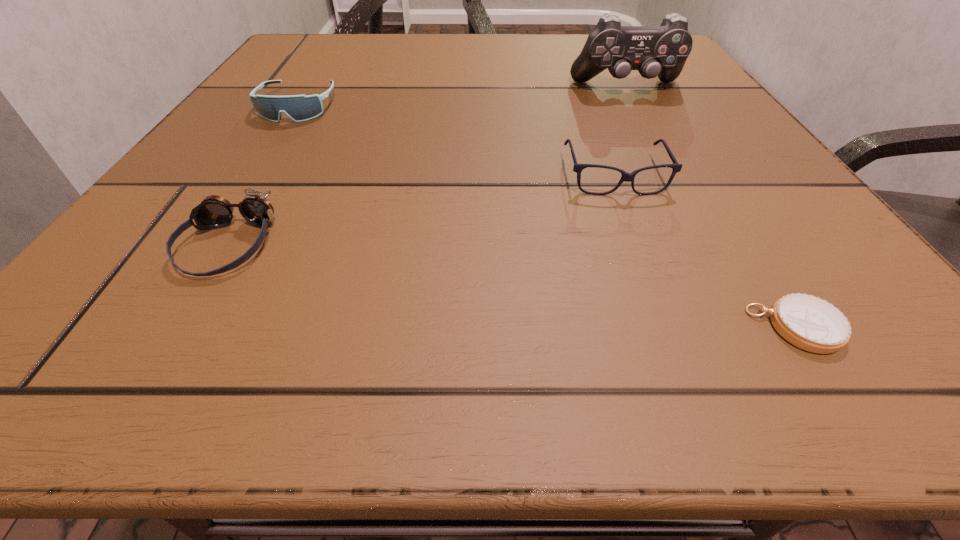
Locate an element on the screen. The image size is (960, 540). unoccupied area between the spectacles and the nearest object is located at coordinates (706, 252).

Find the location of a particular element. vacant area that lies between the second nearest object and the farther goggles is located at coordinates (263, 176).

What are the coordinates of `empty space between the tallest object and the farther goggles` in the screenshot? It's located at (463, 97).

At what (x,y) coordinates should I click in order to perform the action: click on vacant area between the tallest object and the third farthest object. Please return your answer as a coordinate pair (x, y). Looking at the image, I should click on (621, 132).

You are a GUI agent. You are given a task and a screenshot of the screen. Output one action in this format:
    pyautogui.click(x=<x>, y=<y>)
    Task: Click on the free point between the nearer goggles and the farther goggles
    The width and height of the screenshot is (960, 540).
    Given the screenshot: What is the action you would take?
    pyautogui.click(x=263, y=176)

Where is `vacant space that is in between the shortest object and the control`? vacant space that is in between the shortest object and the control is located at coordinates (711, 208).

Find the location of a particular element. blank region between the farther goggles and the spectacles is located at coordinates (456, 141).

What are the coordinates of `vacant area that lies between the tallest object and the second nearest object` in the screenshot? It's located at (427, 167).

Locate an element on the screen. free area in between the nearest object and the spectacles is located at coordinates (706, 252).

Locate which object ranks in proximity to the spectacles. Please provide its 2D coordinates. Your answer should be formatted as a tuple, i.e. [(x, y)], where the tuple contains the x and y coordinates of a point satisfying the conditions above.

[(812, 324)]